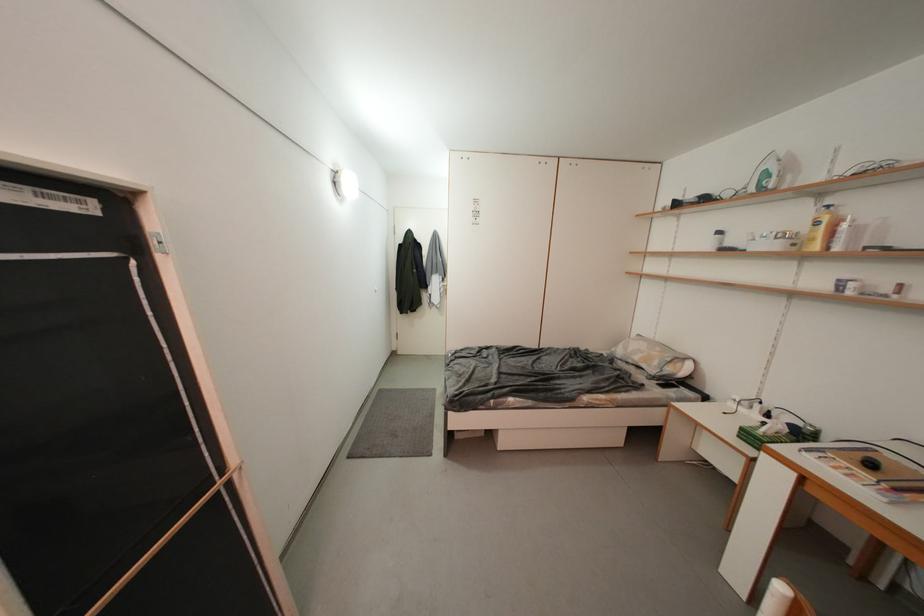
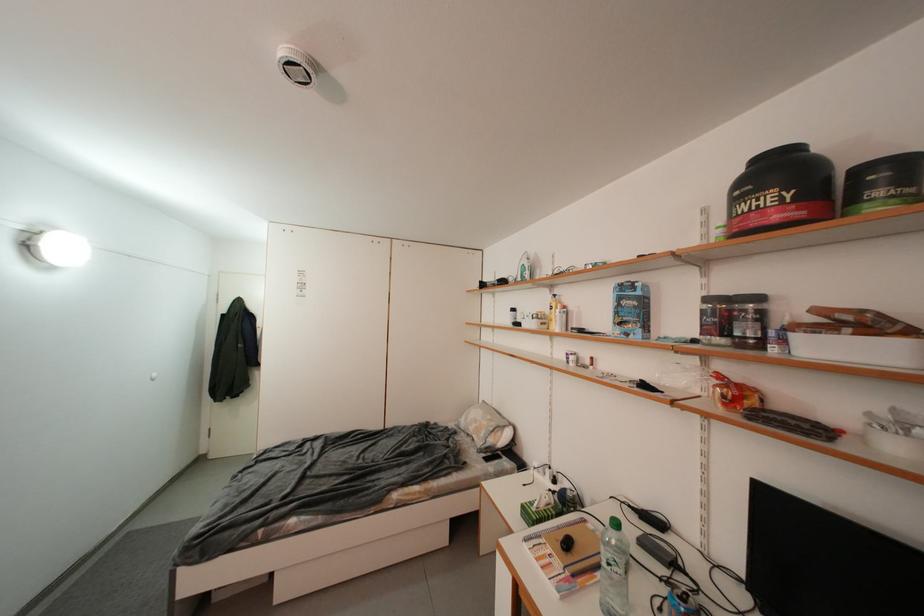
Where in the second image is the point corresponding to the point at 749,432 from the first image?

(530, 509)